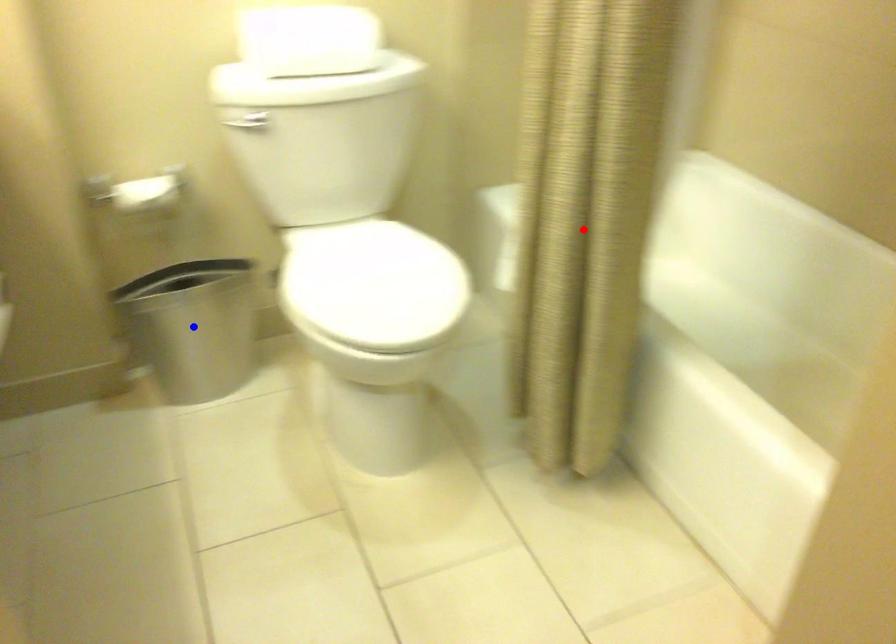
Question: In the image, two points are highlighted. Which point is nearer to the camera? Reply with the corresponding letter.

Choices:
 (A) blue point
 (B) red point

Answer: (B)